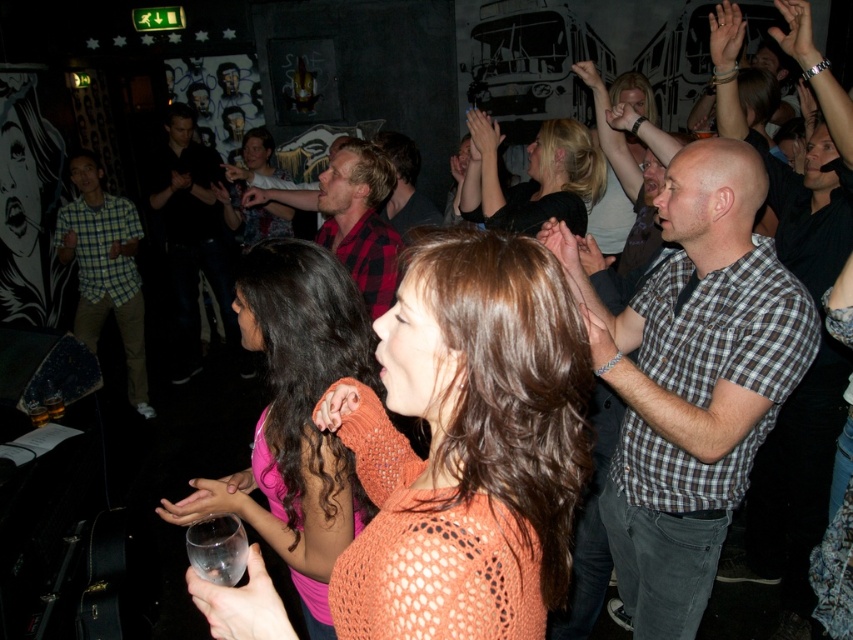
Question: Where is black matte shirt at center located in relation to flannel shirt at center in the image?

Choices:
 (A) above
 (B) below

Answer: (B)

Question: Among these objects, which one is nearest to the camera?

Choices:
 (A) orange knitted sweater at center
 (B) matte black shirt at center
 (C) red plaid shirt at center

Answer: (A)

Question: Is black matte shirt at center smaller than clear glass at center?

Choices:
 (A) yes
 (B) no

Answer: (B)

Question: Can you confirm if knitted orange sweater at center is bigger than black matte shirt at center?

Choices:
 (A) yes
 (B) no

Answer: (B)

Question: Which point appears closest to the camera in this image?

Choices:
 (A) (380, 234)
 (B) (96, 326)

Answer: (A)

Question: Which is farther from the clear glass at center?

Choices:
 (A) black matte shirt at center
 (B) orange knitted sweater at center
 (C) checkered fabric shirt at center

Answer: (A)